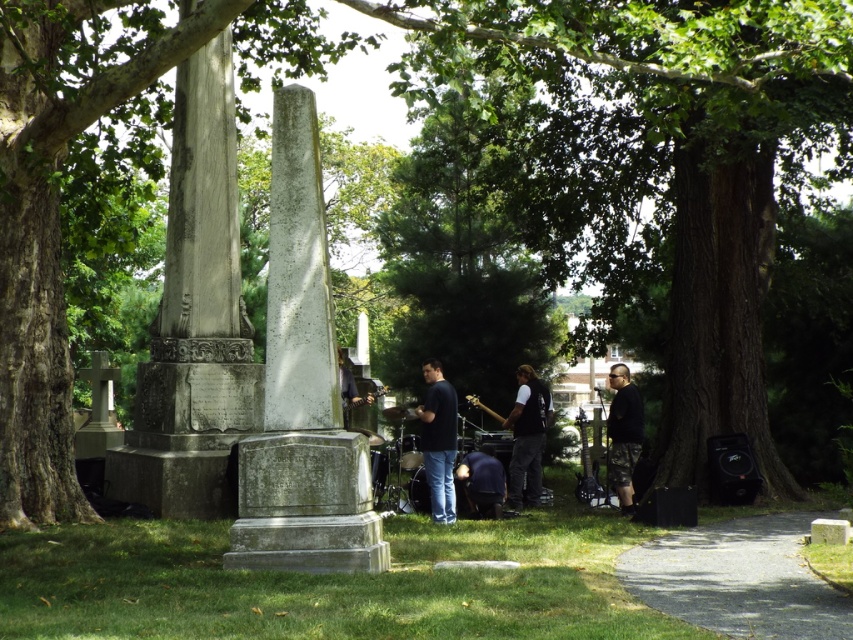
Looking at this image, is dark blue shirt at center wider than black matte vest at center?

No.

Is dark blue shirt at center above black matte vest at center?

Yes, dark blue shirt at center is above black matte vest at center.

Who is more distant from viewer, (x=422, y=435) or (x=537, y=500)?

Point (x=537, y=500)

Where is `dark blue shirt at center`? This screenshot has height=640, width=853. dark blue shirt at center is located at coordinates (438, 440).

Does gray stone monument at center have a greater width compared to gray polished stone obelisk at center?

Indeed, gray stone monument at center has a greater width compared to gray polished stone obelisk at center.

Is gray stone monument at center to the left of gray polished stone obelisk at center from the viewer's perspective?

No, gray stone monument at center is not to the left of gray polished stone obelisk at center.

Does point (328, 552) come in front of point (329, 397)?

Yes.

This screenshot has height=640, width=853. Find the location of `gray stone monument at center`. gray stone monument at center is located at coordinates (300, 388).

Can you confirm if gray polished stone obelisk at center is positioned to the right of black matte vest at center?

In fact, gray polished stone obelisk at center is to the left of black matte vest at center.

Is gray polished stone obelisk at center taller than black matte vest at center?

Correct, gray polished stone obelisk at center is much taller as black matte vest at center.

Which is in front, point (271, 106) or point (515, 449)?

Point (515, 449) is more forward.

Find the location of a particular element. Image resolution: width=853 pixels, height=640 pixels. gray polished stone obelisk at center is located at coordinates (299, 276).